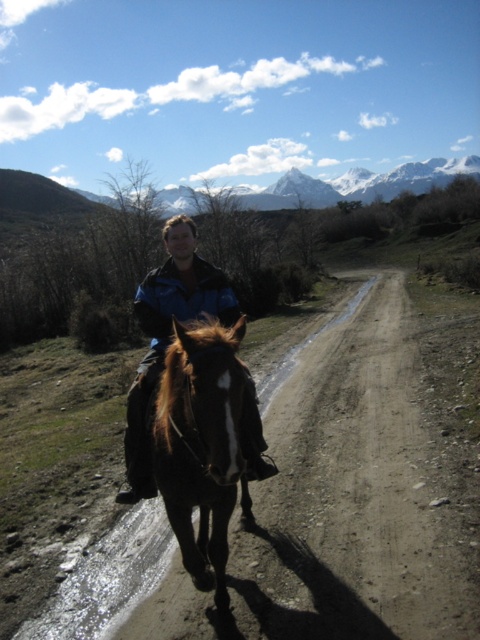
Question: Does brown glossy horse at center lie in front of blue jacket at center?

Choices:
 (A) no
 (B) yes

Answer: (B)

Question: Considering the real-world distances, which object is closest to the brown glossy horse at center?

Choices:
 (A) blue jacket at center
 (B) dirtmaterial/texturetrack at center

Answer: (A)

Question: Is dirtmaterial/texturetrack at center further to the viewer compared to brown glossy horse at center?

Choices:
 (A) no
 (B) yes

Answer: (B)

Question: Among these objects, which one is farthest from the camera?

Choices:
 (A) dirtmaterial/texturetrack at center
 (B) brown glossy horse at center
 (C) blue jacket at center

Answer: (A)

Question: Which of the following is the farthest from the observer?

Choices:
 (A) (143, 378)
 (B) (201, 436)
 (C) (160, 637)

Answer: (A)

Question: Does dirtmaterial/texturetrack at center appear on the right side of brown glossy horse at center?

Choices:
 (A) no
 (B) yes

Answer: (B)